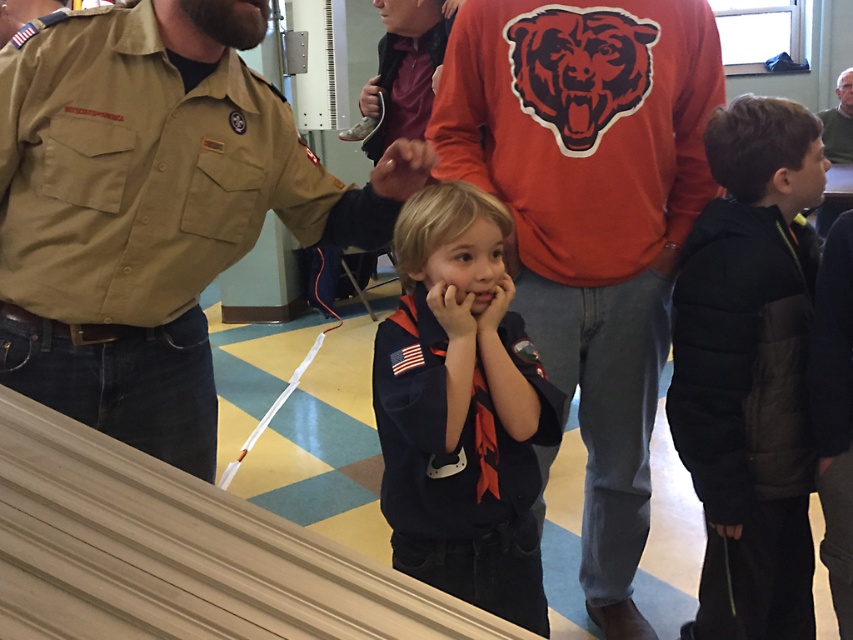
Can you confirm if navy blue uniform at center is positioned to the right of gray knit sweater at upper right?

In fact, navy blue uniform at center is to the left of gray knit sweater at upper right.

Locate an element on the screen. The height and width of the screenshot is (640, 853). navy blue uniform at center is located at coordinates (461, 410).

You are a GUI agent. You are given a task and a screenshot of the screen. Output one action in this format:
    pyautogui.click(x=<x>, y=<y>)
    Task: Click on the navy blue uniform at center
    
    Given the screenshot: What is the action you would take?
    pyautogui.click(x=461, y=410)

Can you confirm if khaki uniform shirt at center is positioned to the right of black puffy jacket at right?

Incorrect, khaki uniform shirt at center is not on the right side of black puffy jacket at right.

Is point (115, 140) farther from camera compared to point (769, 369)?

No.

Where is `khaki uniform shirt at center`? This screenshot has height=640, width=853. khaki uniform shirt at center is located at coordinates (149, 209).

Between point (779, 492) and point (473, 545), which one is positioned in front?

Positioned in front is point (473, 545).

How far apart are black puffy jacket at right and navy blue uniform at center?

The distance of black puffy jacket at right from navy blue uniform at center is 18.50 inches.

The height and width of the screenshot is (640, 853). In order to click on black puffy jacket at right in this screenshot , I will do `click(750, 371)`.

Locate an element on the screen. The width and height of the screenshot is (853, 640). black puffy jacket at right is located at coordinates click(x=750, y=371).